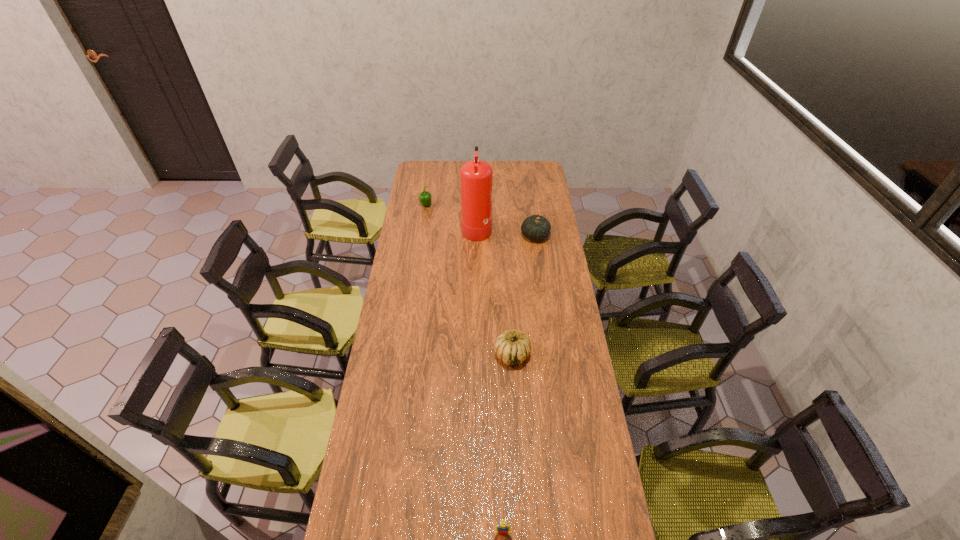
Locate an element on the screen. the tallest object is located at coordinates (476, 176).

Where is `the rightmost object`? the rightmost object is located at coordinates (536, 227).

Where is `the right gourd`? This screenshot has height=540, width=960. the right gourd is located at coordinates (536, 227).

The width and height of the screenshot is (960, 540). I want to click on the leftmost object, so click(x=425, y=197).

Locate an element on the screen. The height and width of the screenshot is (540, 960). bell pepper is located at coordinates (425, 197).

You are a GUI agent. You are given a task and a screenshot of the screen. Output one action in this format:
    pyautogui.click(x=<x>, y=<y>)
    Task: Click on the second nearest object
    The image size is (960, 540).
    Given the screenshot: What is the action you would take?
    pyautogui.click(x=512, y=347)

The image size is (960, 540). What are the coordinates of `the nearer gourd` in the screenshot? It's located at (512, 347).

In order to click on the shortest object in this screenshot , I will do `click(503, 527)`.

Find the location of a particular element. This screenshot has height=540, width=960. Lego is located at coordinates (503, 527).

I want to click on vacant space located 0.180m towards the nozzle of the tallest object, so click(x=524, y=227).